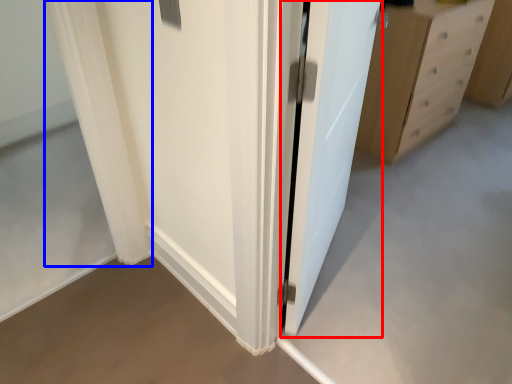
Question: Which object appears farthest to the camera in this image, door (highlighted by a red box) or curtain (highlighted by a blue box)?

Choices:
 (A) door
 (B) curtain

Answer: (B)